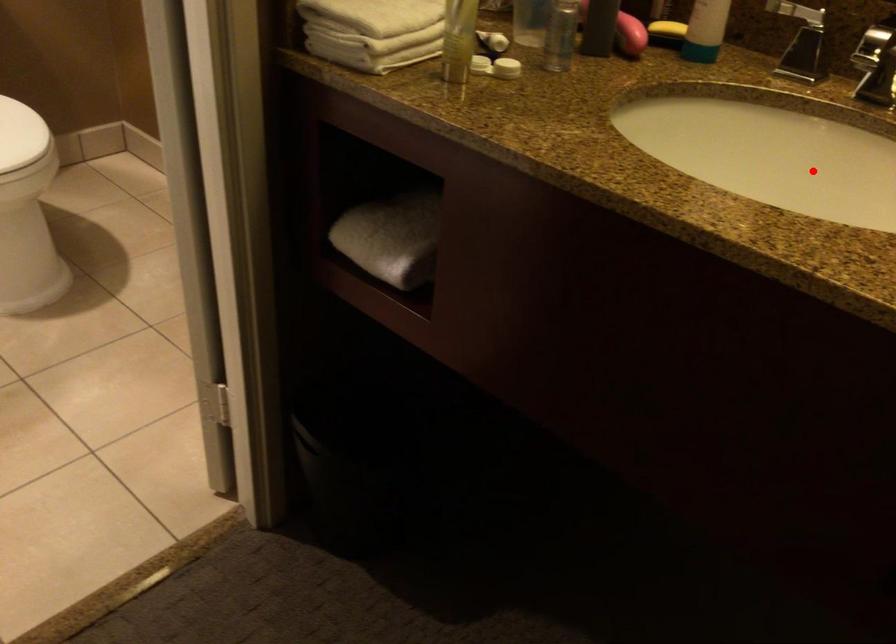
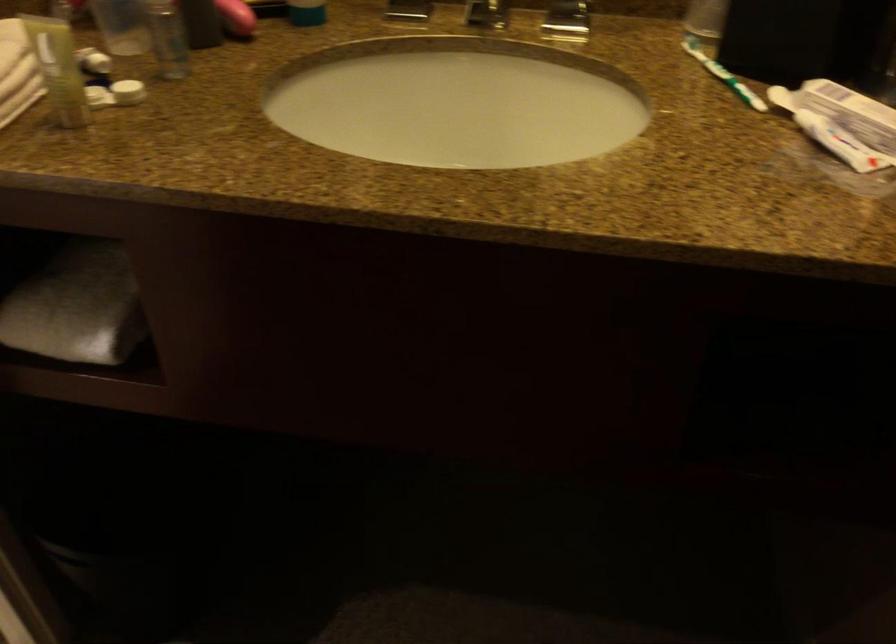
Question: I am providing you with two images of the same scene from different viewpoints. A red point is marked on the first image. At the location where the point appears in image 1, is it still visible in image 2?

Choices:
 (A) Yes
 (B) No

Answer: (A)